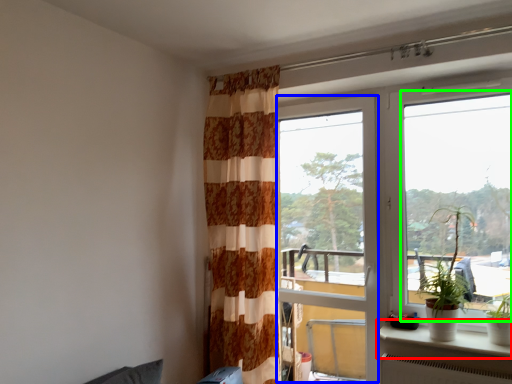
Question: Which object is the closest to the window sill (highlighted by a red box)? Choose among these: screen door (highlighted by a blue box) or window (highlighted by a green box).

Choices:
 (A) screen door
 (B) window

Answer: (A)